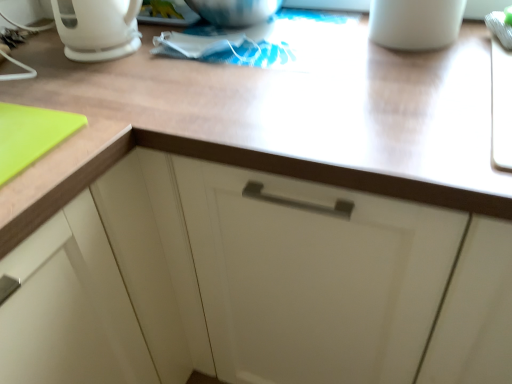
Identify the location of vacant space in front of white glossy coffee pot at upper left. The image size is (512, 384). (100, 82).